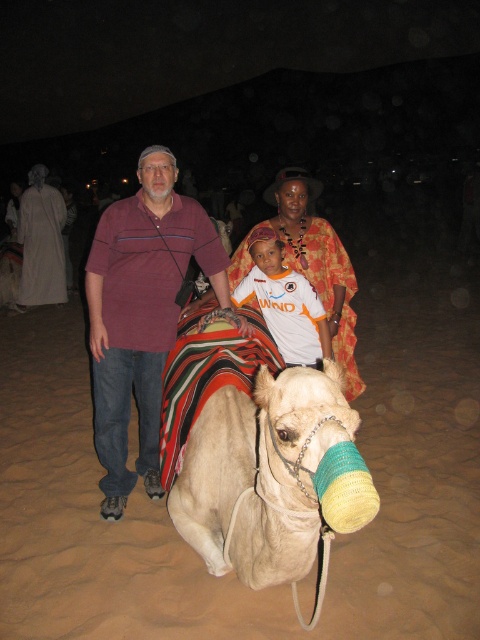
Does light beige fabric camel at center lie behind white cotton robe at left?

No.

Can you confirm if light beige fabric camel at center is wider than white cotton robe at left?

Incorrect, light beige fabric camel at center's width does not surpass white cotton robe at left's.

Locate an element on the screen. The height and width of the screenshot is (640, 480). light beige fabric camel at center is located at coordinates (247, 449).

Which is in front, point (192, 616) or point (41, 204)?

Point (192, 616) is in front.

At what (x,y) coordinates should I click in order to perform the action: click on white sand at lower center. Please return your answer as a coordinate pair (x, y). This screenshot has height=640, width=480. Looking at the image, I should click on (94, 516).

Find the location of a particular element. The image size is (480, 640). white sand at lower center is located at coordinates (94, 516).

Who is positioned more to the left, white sand at lower center or light beige fabric camel at center?

white sand at lower center

Who is more forward, (51, 492) or (217, 520)?

Positioned in front is point (217, 520).

Find the location of a particular element. white sand at lower center is located at coordinates (94, 516).